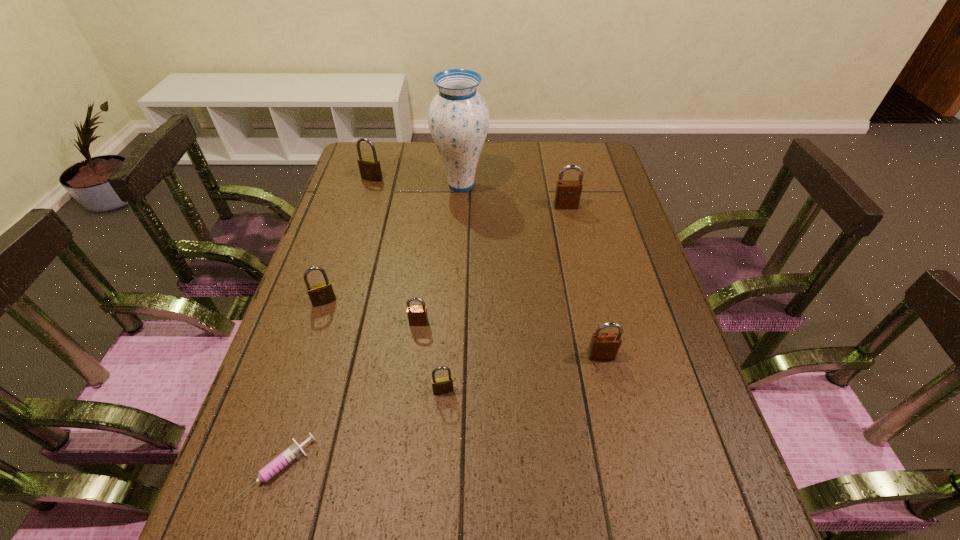
This screenshot has height=540, width=960. I want to click on unoccupied position between the farthest padlock and the shortest object, so click(324, 325).

Locate an element on the screen. The image size is (960, 540). unoccupied position between the second biggest brown padlock and the farthest padlock is located at coordinates [487, 267].

You are a GUI agent. You are given a task and a screenshot of the screen. Output one action in this format:
    pyautogui.click(x=<x>, y=<y>)
    Task: Click on the object that is the fourth closest to the nearest object
    
    Given the screenshot: What is the action you would take?
    pyautogui.click(x=603, y=346)

The height and width of the screenshot is (540, 960). Identify the location of object that ranks as the sixth closest to the blue vase. (442, 385).

Identify which padlock is located as the nearest to the biggest brass padlock. Please provide its 2D coordinates. Your answer should be formatted as a tuple, i.e. [(x, y)], where the tuple contains the x and y coordinates of a point satisfying the conditions above.

[(320, 294)]

Identify which padlock is located as the third nearest to the biggest brown padlock. Please provide its 2D coordinates. Your answer should be formatted as a tuple, i.e. [(x, y)], where the tuple contains the x and y coordinates of a point satisfying the conditions above.

[(370, 169)]

Locate which brass padlock ranks in proximity to the sixth nearest object. Please provide its 2D coordinates. Your answer should be formatted as a tuple, i.e. [(x, y)], where the tuple contains the x and y coordinates of a point satisfying the conditions above.

[(370, 169)]

Locate which brass padlock is the closest to the fifth farthest padlock. Please provide its 2D coordinates. Your answer should be formatted as a tuple, i.e. [(x, y)], where the tuple contains the x and y coordinates of a point satisfying the conditions above.

[(442, 385)]

Locate which brown padlock ranks second in proximity to the sixth nearest object. Please provide its 2D coordinates. Your answer should be formatted as a tuple, i.e. [(x, y)], where the tuple contains the x and y coordinates of a point satisfying the conditions above.

[(417, 315)]

Locate an element on the screen. This screenshot has width=960, height=540. brown padlock identified as the closest to the fourth farthest object is located at coordinates (417, 315).